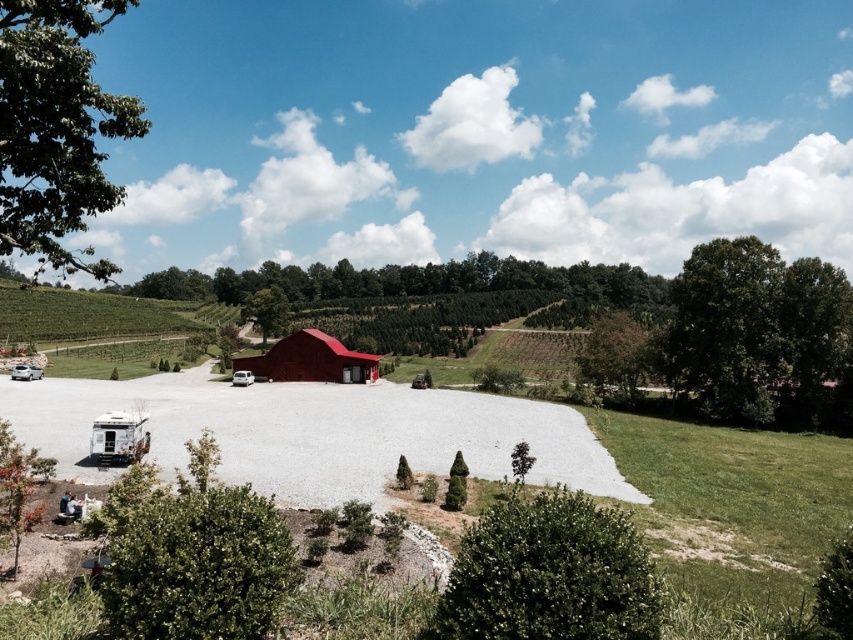
Question: Which object is farther from the camera taking this photo?

Choices:
 (A) green leafy tree at upper left
 (B) green leafy tree at center
 (C) white matte recreational vehicle at lower left

Answer: (B)

Question: Is matte red barn at center closer to camera compared to white matte recreational vehicle at lower left?

Choices:
 (A) yes
 (B) no

Answer: (B)

Question: Among these objects, which one is farthest from the camera?

Choices:
 (A) silver metallic rv at lower left
 (B) green leafy tree at center-right

Answer: (A)

Question: Which object is farther from the camera taking this photo?

Choices:
 (A) silver metallic rv at lower left
 (B) green leafy tree at center-right
 (C) white matte recreational vehicle at center
 (D) matte red barn at center

Answer: (D)

Question: Does matte red barn at center appear under green leafy tree at center-right?

Choices:
 (A) no
 (B) yes

Answer: (B)

Question: Where is green leafy tree at right located in relation to green leafy tree at center in the image?

Choices:
 (A) below
 (B) above

Answer: (A)